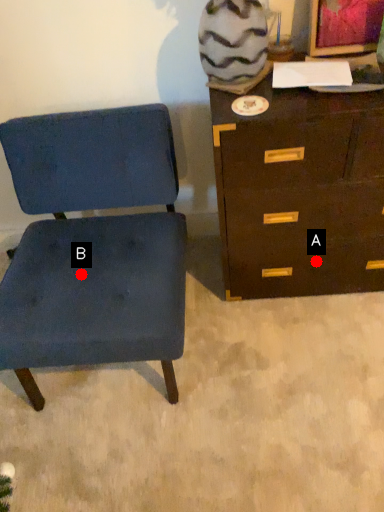
Question: Two points are circled on the image, labeled by A and B beside each circle. Which point is further to the camera?

Choices:
 (A) A is further
 (B) B is further

Answer: (A)